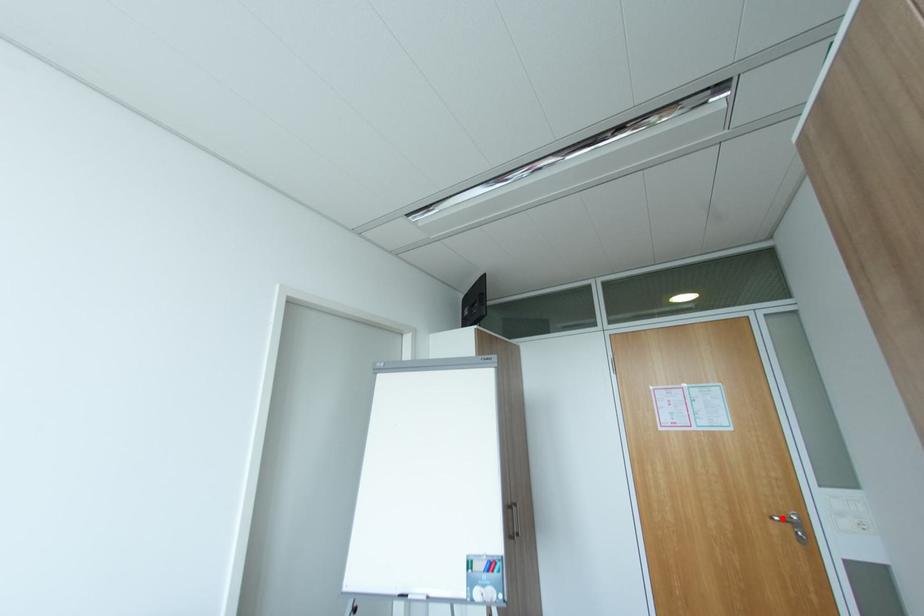
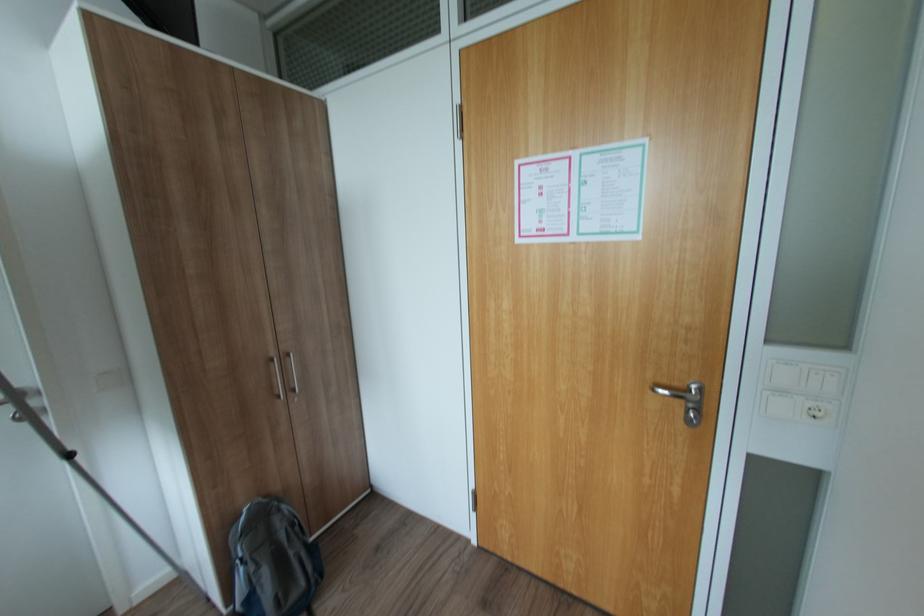
Question: I am providing you with two images of the same scene from different viewpoints. In image1, a red point is highlighted. Considering the same 3D point in image2, which of the following is correct?

Choices:
 (A) It is closer
 (B) It is farther

Answer: (B)